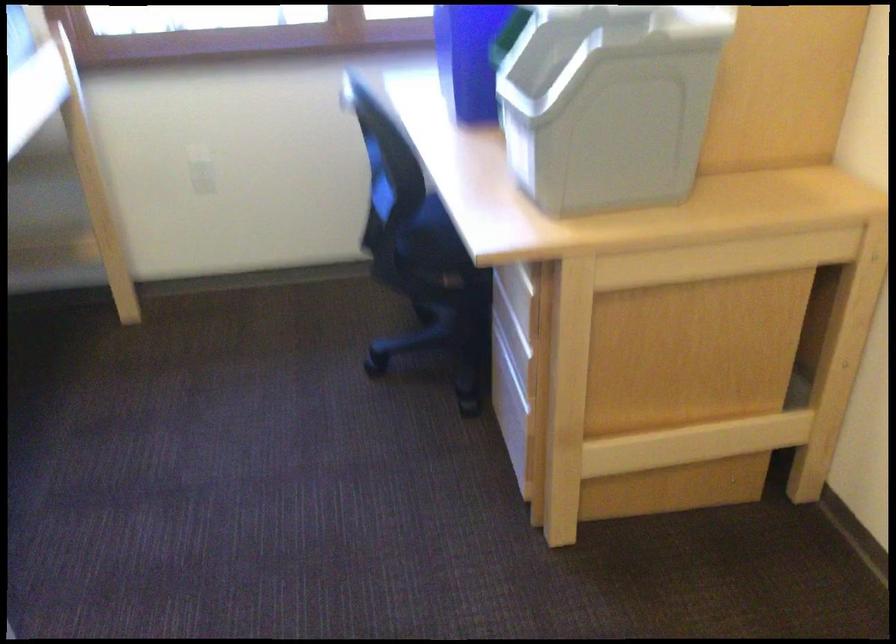
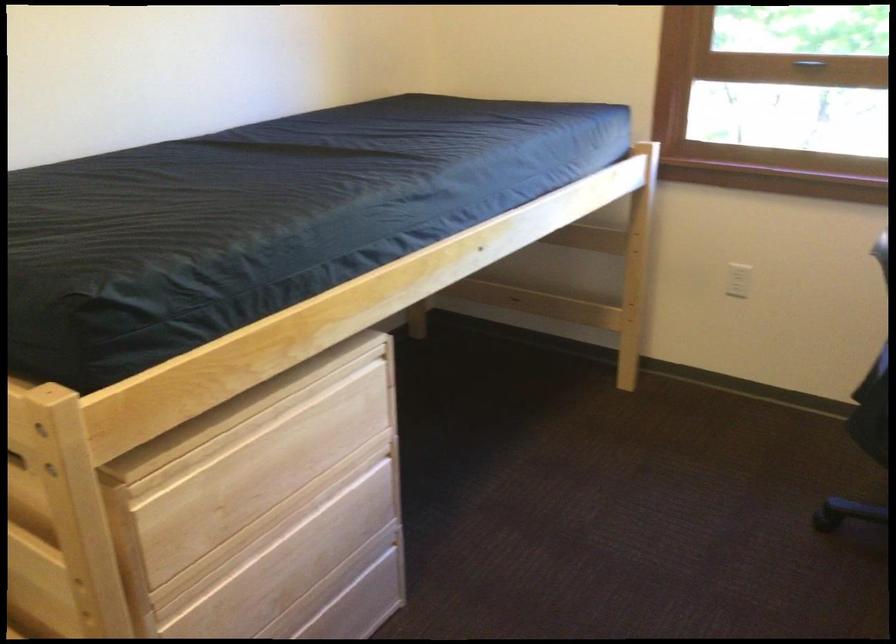
In the second image, find the point that corresponds to (211,176) in the first image.

(738, 279)